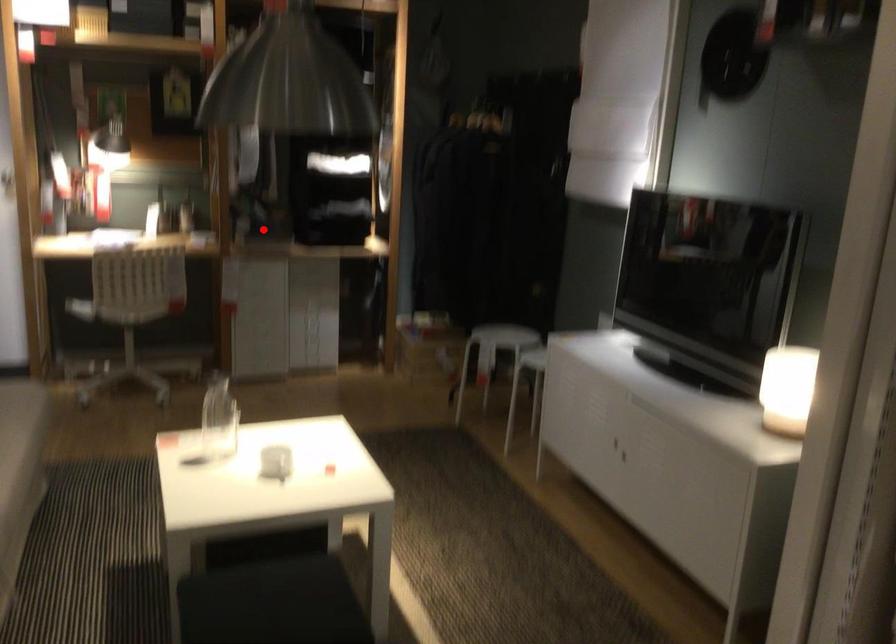
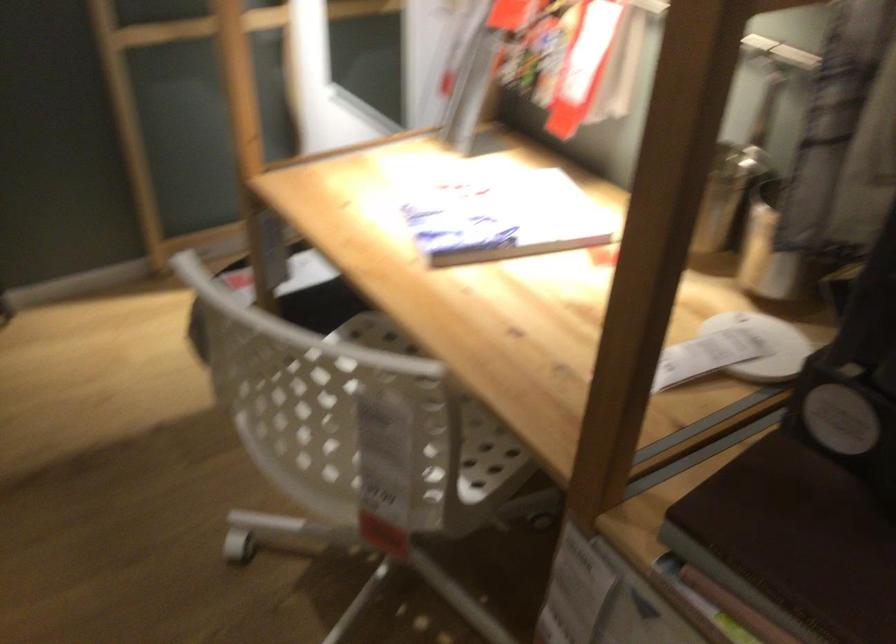
The point at the highlighted location is marked in the first image. Where is the corresponding point in the second image?

(793, 542)